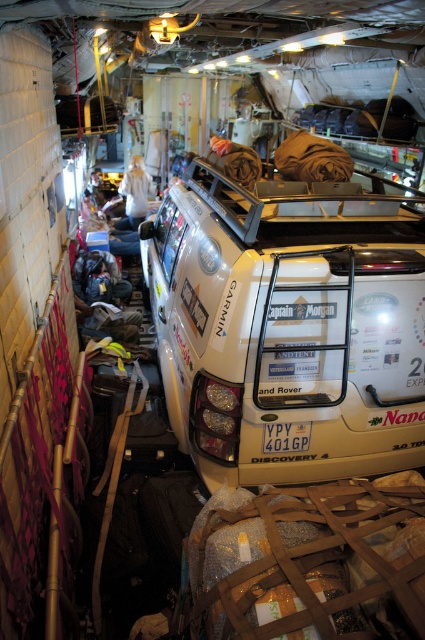
You are standing inside the ship looking at the white Land Rover Discovery 4. There are two points marked on the vehicle. Which point is closer to you, point at coordinate (x=323, y=253) or point at coordinate (x=291, y=445)?

Point at coordinate (x=323, y=253) is closer to you than point at coordinate (x=291, y=445).

You are a delivery person who needs to park the white matte suv at center in a parking spot that is exactly the same width as the white plastic license plate at center. Will the suv fit in the parking spot?

The white matte suv at center is wider than the white plastic license plate at center, so it will not fit in the parking spot designed to match the license plate width.

Based on the scene description, where is the white matte suv at center located in terms of its 2D coordinates?

The white matte suv at center is located at the 2D coordinates of point (x=288, y=326).